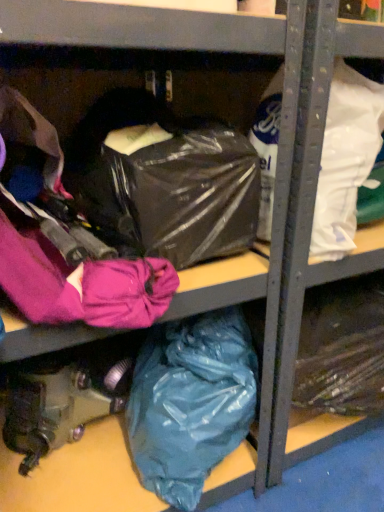
Locate an element on the screen. teal matte plastic bag at lower center, the 2th plastic bag from the top is located at coordinates (190, 402).

Image resolution: width=384 pixels, height=512 pixels. What do you see at coordinates (186, 191) in the screenshot?
I see `transparent plastic bag at center` at bounding box center [186, 191].

From the picture: What is the approximate height of white matte plastic bag at upper right, which ranks as the 2th plastic bag in bottom-to-top order?

33.46 centimeters.

You are a GUI agent. You are given a task and a screenshot of the screen. Output one action in this format:
    pyautogui.click(x=<x>, y=<y>)
    Task: Click on the teal matte plastic bag at lower center, the 2th plastic bag from the top
    This screenshot has height=512, width=384.
    Given the screenshot: What is the action you would take?
    pyautogui.click(x=190, y=402)

Is white matte plastic bag at upper right, the first plastic bag in the top-to-bottom sequence, located outside transparent plastic bag at center?

white matte plastic bag at upper right, the first plastic bag in the top-to-bottom sequence, lies outside transparent plastic bag at center's area.

From the transparent plastic bag at center, count 1st plastic bags backward and point to it. Please provide its 2D coordinates.

[(346, 159)]

Does white matte plastic bag at upper right, the first plastic bag in the top-to-bottom sequence, appear on the right side of transparent plastic bag at center?

Indeed, white matte plastic bag at upper right, the first plastic bag in the top-to-bottom sequence, is positioned on the right side of transparent plastic bag at center.

Is white matte plastic bag at upper right, the first plastic bag in the top-to-bottom sequence, next to transparent plastic bag at center and touching it?

No, white matte plastic bag at upper right, the first plastic bag in the top-to-bottom sequence, is not with transparent plastic bag at center.

Which object is more forward, teal matte plastic bag at lower center, the 2th plastic bag from the top, or white matte plastic bag at upper right, the first plastic bag in the top-to-bottom sequence?

white matte plastic bag at upper right, the first plastic bag in the top-to-bottom sequence.

Looking at the image, does teal matte plastic bag at lower center, the 2th plastic bag from the top, seem bigger or smaller compared to white matte plastic bag at upper right, which ranks as the 2th plastic bag in bottom-to-top order?

Clearly, teal matte plastic bag at lower center, the 2th plastic bag from the top, is larger in size than white matte plastic bag at upper right, which ranks as the 2th plastic bag in bottom-to-top order.

In the scene shown: Who is shorter, teal matte plastic bag at lower center, the 2th plastic bag from the top, or white matte plastic bag at upper right, the first plastic bag in the top-to-bottom sequence?

white matte plastic bag at upper right, the first plastic bag in the top-to-bottom sequence.

Looking at this image, from a real-world perspective, is teal matte plastic bag at lower center, which is counted as the first plastic bag, starting from the bottom, above or below transparent plastic bag at center?

From a real-world perspective, teal matte plastic bag at lower center, which is counted as the first plastic bag, starting from the bottom, is physically below transparent plastic bag at center.

In the scene shown: Is teal matte plastic bag at lower center, the 2th plastic bag from the top, aimed at transparent plastic bag at center?

No, teal matte plastic bag at lower center, the 2th plastic bag from the top, is not turned towards transparent plastic bag at center.

Locate an element on the screen. This screenshot has width=384, height=512. bag above the teal matte plastic bag at lower center, the 2th plastic bag from the top (from a real-world perspective) is located at coordinates coord(186,191).

This screenshot has width=384, height=512. What are the coordinates of `plastic bag above the transparent plastic bag at center (from the image's perspective)` in the screenshot? It's located at (346, 159).

Considering the relative positions of transparent plastic bag at center and white matte plastic bag at upper right, which ranks as the 2th plastic bag in bottom-to-top order, in the image provided, is transparent plastic bag at center to the left of white matte plastic bag at upper right, which ranks as the 2th plastic bag in bottom-to-top order, from the viewer's perspective?

Yes.

Consider the image. Is transparent plastic bag at center in front of or behind white matte plastic bag at upper right, which ranks as the 2th plastic bag in bottom-to-top order, in the image?

In the image, transparent plastic bag at center appears in front of white matte plastic bag at upper right, which ranks as the 2th plastic bag in bottom-to-top order.

Is transparent plastic bag at center touching white matte plastic bag at upper right, which ranks as the 2th plastic bag in bottom-to-top order?

There is a gap between transparent plastic bag at center and white matte plastic bag at upper right, which ranks as the 2th plastic bag in bottom-to-top order.

Is transparent plastic bag at center positioned beyond the bounds of teal matte plastic bag at lower center, the 2th plastic bag from the top?

That's correct, transparent plastic bag at center is outside of teal matte plastic bag at lower center, the 2th plastic bag from the top.

Is the surface of transparent plastic bag at center in direct contact with teal matte plastic bag at lower center, which is counted as the first plastic bag, starting from the bottom?

No, transparent plastic bag at center is not beside teal matte plastic bag at lower center, which is counted as the first plastic bag, starting from the bottom.

Does transparent plastic bag at center come behind teal matte plastic bag at lower center, which is counted as the first plastic bag, starting from the bottom?

That is False.

From the image's perspective, is white matte plastic bag at upper right, which ranks as the 2th plastic bag in bottom-to-top order, located above or below teal matte plastic bag at lower center, the 2th plastic bag from the top?

Clearly, from the image's perspective, white matte plastic bag at upper right, which ranks as the 2th plastic bag in bottom-to-top order, is above teal matte plastic bag at lower center, the 2th plastic bag from the top.

How far apart are white matte plastic bag at upper right, which ranks as the 2th plastic bag in bottom-to-top order, and teal matte plastic bag at lower center, the 2th plastic bag from the top?

The distance of white matte plastic bag at upper right, which ranks as the 2th plastic bag in bottom-to-top order, from teal matte plastic bag at lower center, the 2th plastic bag from the top, is 15.05 inches.

From the picture: From a real-world perspective, between white matte plastic bag at upper right, the first plastic bag in the top-to-bottom sequence, and teal matte plastic bag at lower center, the 2th plastic bag from the top, who is vertically higher?

white matte plastic bag at upper right, the first plastic bag in the top-to-bottom sequence, from a real-world perspective.

Does white matte plastic bag at upper right, the first plastic bag in the top-to-bottom sequence, have a greater width compared to teal matte plastic bag at lower center, the 2th plastic bag from the top?

Correct, the width of white matte plastic bag at upper right, the first plastic bag in the top-to-bottom sequence, exceeds that of teal matte plastic bag at lower center, the 2th plastic bag from the top.

This screenshot has width=384, height=512. What are the coordinates of `bag in front of the white matte plastic bag at upper right, which ranks as the 2th plastic bag in bottom-to-top order` in the screenshot? It's located at (186, 191).

I want to click on plastic bag that is below the white matte plastic bag at upper right, the first plastic bag in the top-to-bottom sequence (from the image's perspective), so click(190, 402).

Based on their spatial positions, is transparent plastic bag at center or teal matte plastic bag at lower center, which is counted as the first plastic bag, starting from the bottom, closer to white matte plastic bag at upper right, the first plastic bag in the top-to-bottom sequence?

transparent plastic bag at center.

When comparing their distances from transparent plastic bag at center, does white matte plastic bag at upper right, the first plastic bag in the top-to-bottom sequence, or teal matte plastic bag at lower center, which is counted as the first plastic bag, starting from the bottom, seem further?

Among the two, teal matte plastic bag at lower center, which is counted as the first plastic bag, starting from the bottom, is located further to transparent plastic bag at center.

Based on their spatial positions, is transparent plastic bag at center or white matte plastic bag at upper right, which ranks as the 2th plastic bag in bottom-to-top order, further from teal matte plastic bag at lower center, which is counted as the first plastic bag, starting from the bottom?

Among the two, white matte plastic bag at upper right, which ranks as the 2th plastic bag in bottom-to-top order, is located further to teal matte plastic bag at lower center, which is counted as the first plastic bag, starting from the bottom.

From the image, which object appears to be nearer to teal matte plastic bag at lower center, which is counted as the first plastic bag, starting from the bottom, white matte plastic bag at upper right, the first plastic bag in the top-to-bottom sequence, or transparent plastic bag at center?

transparent plastic bag at center lies closer to teal matte plastic bag at lower center, which is counted as the first plastic bag, starting from the bottom, than the other object.

When comparing their distances from transparent plastic bag at center, does teal matte plastic bag at lower center, the 2th plastic bag from the top, or white matte plastic bag at upper right, which ranks as the 2th plastic bag in bottom-to-top order, seem further?

Based on the image, teal matte plastic bag at lower center, the 2th plastic bag from the top, appears to be further to transparent plastic bag at center.

Based on their spatial positions, is teal matte plastic bag at lower center, the 2th plastic bag from the top, or transparent plastic bag at center further from white matte plastic bag at upper right, which ranks as the 2th plastic bag in bottom-to-top order?

teal matte plastic bag at lower center, the 2th plastic bag from the top, lies further to white matte plastic bag at upper right, which ranks as the 2th plastic bag in bottom-to-top order, than the other object.

I want to click on bag between white matte plastic bag at upper right, the first plastic bag in the top-to-bottom sequence, and teal matte plastic bag at lower center, which is counted as the first plastic bag, starting from the bottom, in the up-down direction, so click(x=186, y=191).